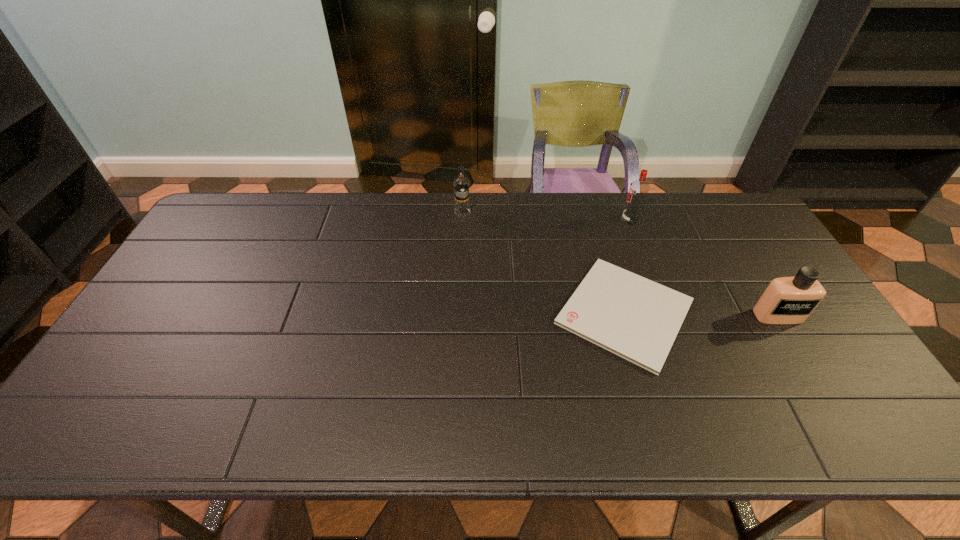
At what (x,y) coordinates should I click in order to perform the action: click on the right vodka. Please return your answer as a coordinate pair (x, y). Looking at the image, I should click on (638, 191).

Locate an element on the screen. This screenshot has width=960, height=540. the left vodka is located at coordinates (461, 184).

This screenshot has height=540, width=960. Identify the location of the rightmost object. (787, 300).

Locate an element on the screen. the shortest object is located at coordinates (633, 317).

Where is `free space located 0.060m on the front label of the right vodka`? This screenshot has width=960, height=540. free space located 0.060m on the front label of the right vodka is located at coordinates (604, 220).

The width and height of the screenshot is (960, 540). What are the coordinates of `free space located on the front label of the right vodka` in the screenshot? It's located at pos(563,220).

You are a GUI agent. You are given a task and a screenshot of the screen. Output one action in this format:
    pyautogui.click(x=<x>, y=<y>)
    Task: Click on the vacant space positioned on the front label of the right vodka
    The image size is (960, 540).
    Given the screenshot: What is the action you would take?
    pyautogui.click(x=594, y=220)

Locate an element on the screen. This screenshot has height=540, width=960. vacant space located on the label of the left vodka is located at coordinates (459, 296).

Identify the location of free space located on the front label of the perfume. This screenshot has width=960, height=540. (808, 366).

The width and height of the screenshot is (960, 540). Find the location of `free space located on the back of the shortest object`. free space located on the back of the shortest object is located at coordinates (604, 242).